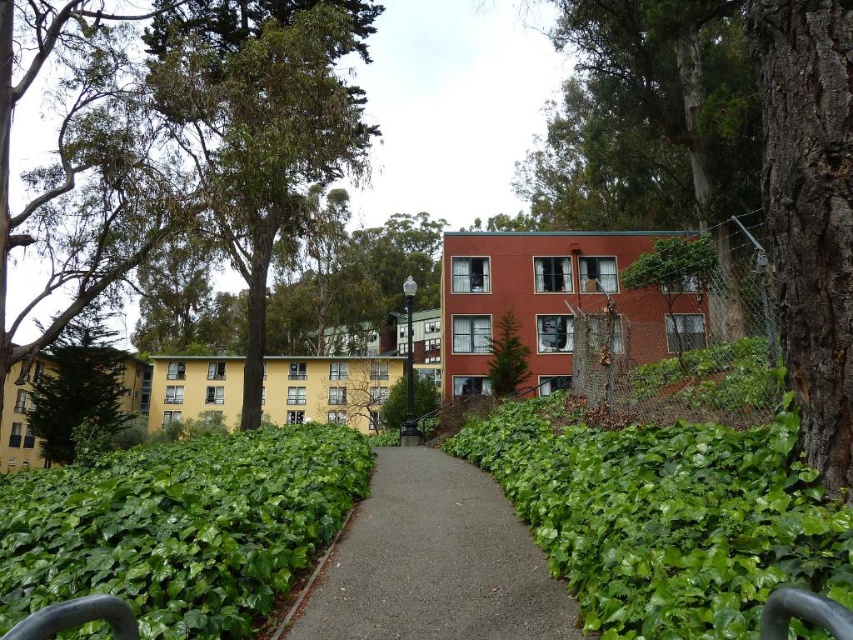
Question: Which point is farther to the camera?

Choices:
 (A) (474, 513)
 (B) (114, 474)

Answer: (B)

Question: Does green leafy hedge at lower left appear on the left side of dark brown bark tree at right?

Choices:
 (A) yes
 (B) no

Answer: (A)

Question: Which point is farther to the camera?

Choices:
 (A) dark brown bark tree at right
 (B) green leafy hedge at center
 (C) green leafy bush at center
 (D) green leafy tree at upper right

Answer: (C)

Question: Which object appears farthest from the camera in this image?

Choices:
 (A) green leafy hedge at lower left
 (B) green leafy hedge at center
 (C) green leafy bush at center
 (D) green leafy tree at upper right

Answer: (C)

Question: Is green leafy hedge at lower left smaller than green leafy bush at center?

Choices:
 (A) no
 (B) yes

Answer: (B)

Question: Is green leafy hedge at center positioned in front of dark brown bark tree at right?

Choices:
 (A) no
 (B) yes

Answer: (B)